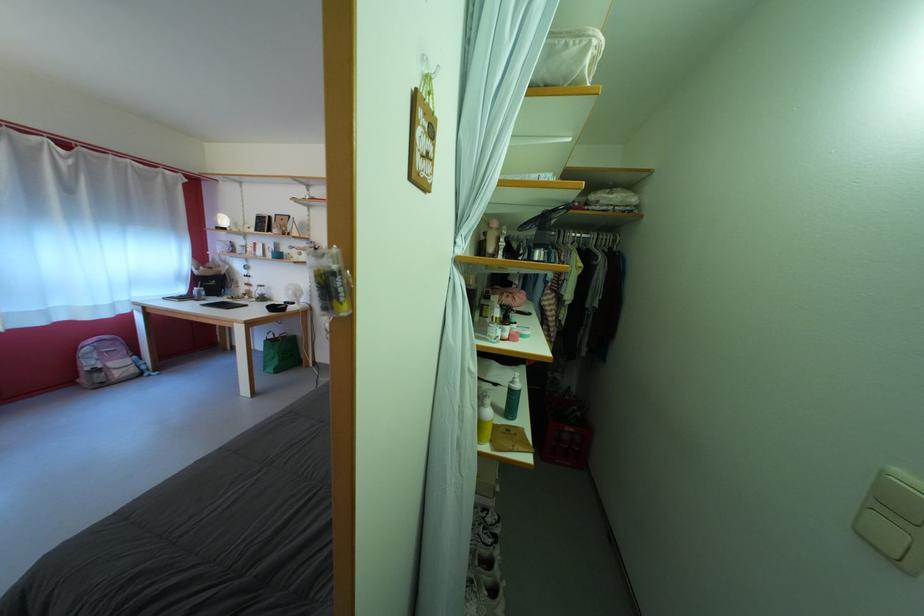
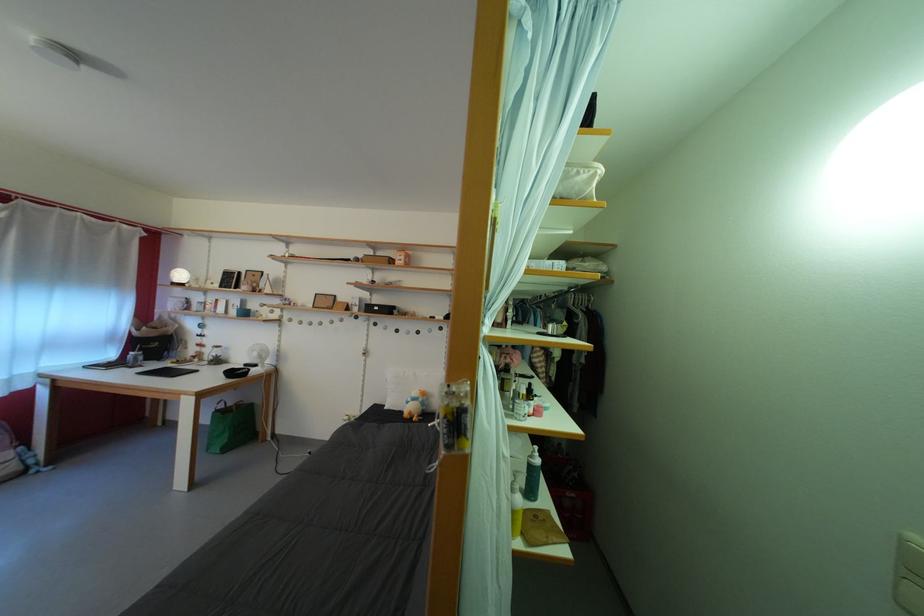
Where in the second image is the point corresponding to (299,299) from the first image?

(263, 360)